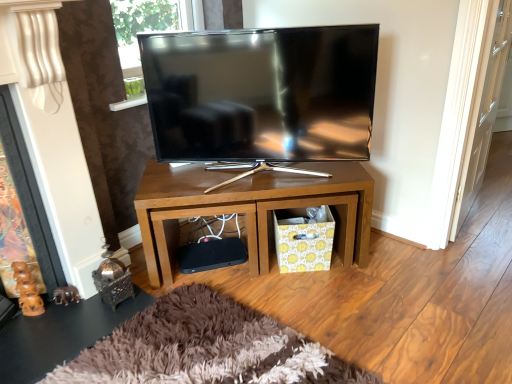
Find the location of `vacant space in front of wooden tv stand at center`. vacant space in front of wooden tv stand at center is located at coordinates (285, 318).